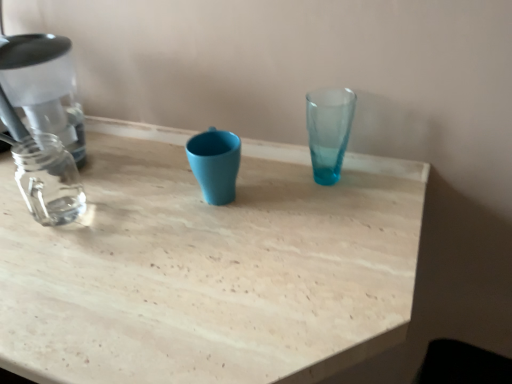
Question: Can you confirm if translucent glass vase at upper center is smaller than light wood table at center?

Choices:
 (A) yes
 (B) no

Answer: (A)

Question: Can you confirm if translucent glass vase at upper center is shorter than light wood table at center?

Choices:
 (A) yes
 (B) no

Answer: (A)

Question: Does translucent glass vase at upper center have a greater height compared to light wood table at center?

Choices:
 (A) no
 (B) yes

Answer: (A)

Question: From the image's perspective, is translucent glass vase at upper center under light wood table at center?

Choices:
 (A) yes
 (B) no

Answer: (B)

Question: Can you confirm if translucent glass vase at upper center is wider than light wood table at center?

Choices:
 (A) no
 (B) yes

Answer: (A)

Question: From a real-world perspective, does translucent glass vase at upper center stand above light wood table at center?

Choices:
 (A) no
 (B) yes

Answer: (B)

Question: Does light wood table at center have a larger size compared to translucent glass vase at upper center?

Choices:
 (A) yes
 (B) no

Answer: (A)

Question: Is light wood table at center beside translucent glass vase at upper center?

Choices:
 (A) yes
 (B) no

Answer: (B)

Question: Is light wood table at center positioned far away from translucent glass vase at upper center?

Choices:
 (A) no
 (B) yes

Answer: (A)

Question: Is light wood table at center smaller than translucent glass vase at upper center?

Choices:
 (A) no
 (B) yes

Answer: (A)

Question: Is light wood table at center closer to the viewer compared to translucent glass vase at upper center?

Choices:
 (A) yes
 (B) no

Answer: (A)

Question: Is light wood table at center shorter than translucent glass vase at upper center?

Choices:
 (A) yes
 (B) no

Answer: (B)

Question: Considering the relative positions of light wood table at center and translucent glass vase at upper center in the image provided, is light wood table at center to the left or to the right of translucent glass vase at upper center?

Choices:
 (A) right
 (B) left

Answer: (B)